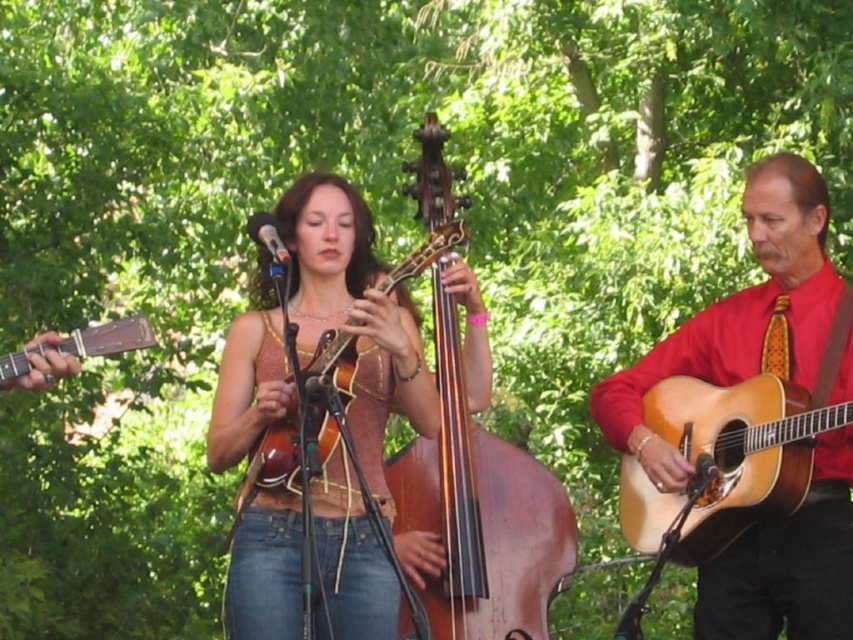
Does matte brown mandolin at center have a lesser height compared to metallic blue microphone at center?

Incorrect, matte brown mandolin at center's height does not fall short of metallic blue microphone at center's.

Is point (378, 605) positioned behind point (265, 250)?

No, it is in front of (265, 250).

Describe the element at coordinates (355, 314) in the screenshot. This screenshot has height=640, width=853. I see `matte brown mandolin at center` at that location.

Image resolution: width=853 pixels, height=640 pixels. Identify the location of matte brown mandolin at center. (355, 314).

Is point (283, 589) farther from camera compared to point (115, 330)?

Yes, it is.

Is point (244, 385) less distant than point (102, 352)?

No.

You are a GUI agent. You are given a task and a screenshot of the screen. Output one action in this format:
    pyautogui.click(x=<x>, y=<y>)
    Task: Click on the matte brown mandolin at center
    
    Given the screenshot: What is the action you would take?
    pyautogui.click(x=355, y=314)

Can you confirm if brown polished wood cello at center is bigger than matte brown guitar at left?

Yes.

Locate an element on the screen. The width and height of the screenshot is (853, 640). brown polished wood cello at center is located at coordinates (479, 508).